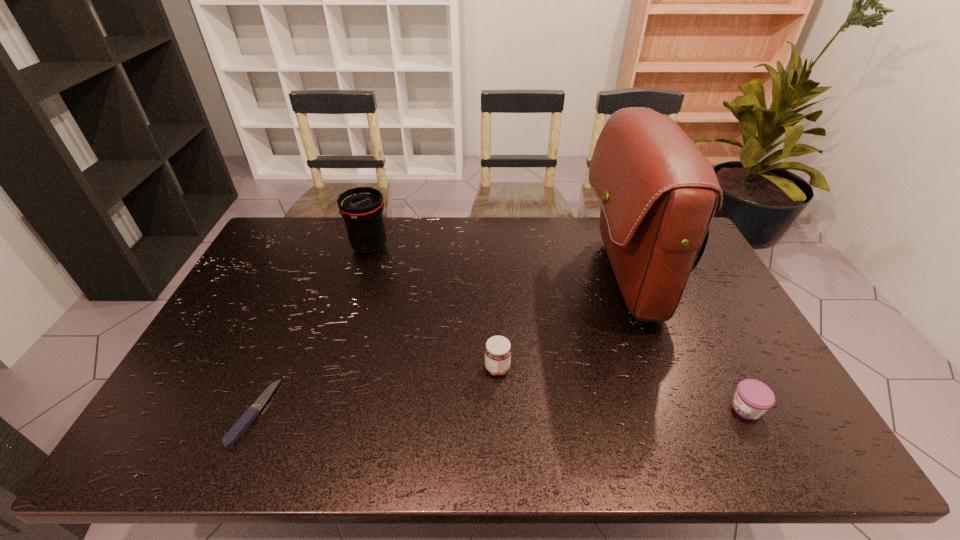
You are a GUI agent. You are given a task and a screenshot of the screen. Output one action in this format:
    pyautogui.click(x=<x>, y=<y>)
    Task: Click on the vacant area between the shortest object and the right jam
    The width and height of the screenshot is (960, 540).
    Given the screenshot: What is the action you would take?
    pyautogui.click(x=500, y=411)

Image resolution: width=960 pixels, height=540 pixels. Find the location of `vacant area that lies between the telephoto lens and the fourth object from left to right`. vacant area that lies between the telephoto lens and the fourth object from left to right is located at coordinates (497, 263).

Locate an element on the screen. Image resolution: width=960 pixels, height=540 pixels. free space between the fourth shortest object and the taller jam is located at coordinates (434, 308).

At what (x,y) coordinates should I click in order to perform the action: click on empty location between the fourth shortest object and the rightmost object. Please return your answer as a coordinate pair (x, y). Looking at the image, I should click on (558, 328).

Image resolution: width=960 pixels, height=540 pixels. I want to click on free area in between the rightmost object and the satchel, so click(685, 343).

I want to click on vacant area that lies between the farther jam and the shorter jam, so click(622, 388).

Identify the location of empty space that is in between the fourth shortest object and the right jam. The image size is (960, 540). (558, 328).

You are a GUI agent. You are given a task and a screenshot of the screen. Output one action in this format:
    pyautogui.click(x=<x>, y=<y>)
    Task: Click on the third closest object relative to the tallest object
    
    Given the screenshot: What is the action you would take?
    pyautogui.click(x=361, y=207)

This screenshot has width=960, height=540. I want to click on the third closest object relative to the shorter jam, so click(x=361, y=207).

At what (x,y) coordinates should I click in order to perform the action: click on free space in the image that satisfies the following two spatial constraints: 1. on the open flap of the second object from right to left; 2. on the front side of the shortest object. Please return your answer as a coordinate pair (x, y). This screenshot has width=960, height=540. Looking at the image, I should click on (674, 413).